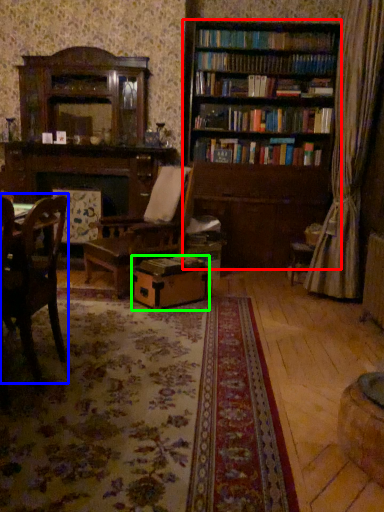
Question: Which object is the farthest from bookcase (highlighted by a red box)? Choose among these: chair (highlighted by a blue box) or cardboard box (highlighted by a green box).

Choices:
 (A) chair
 (B) cardboard box

Answer: (A)